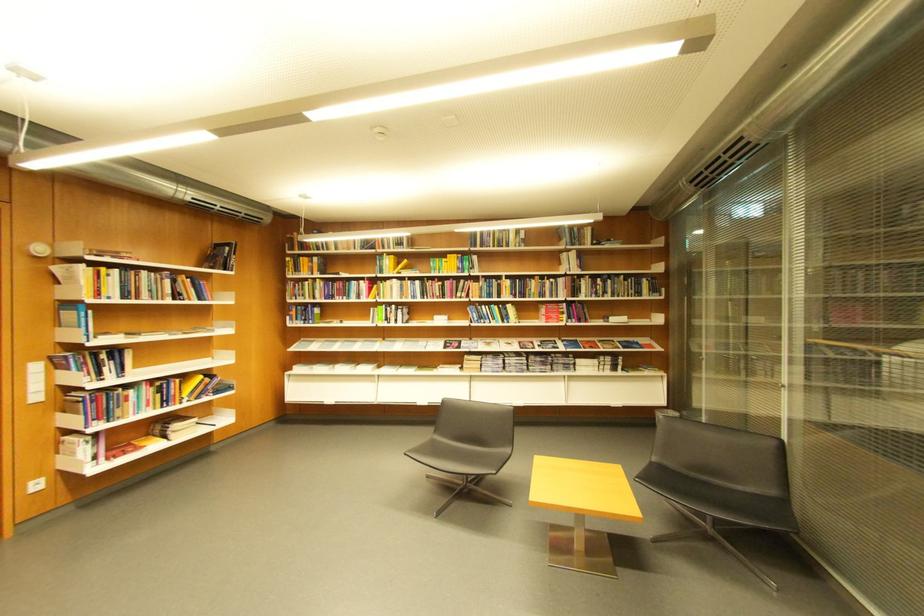
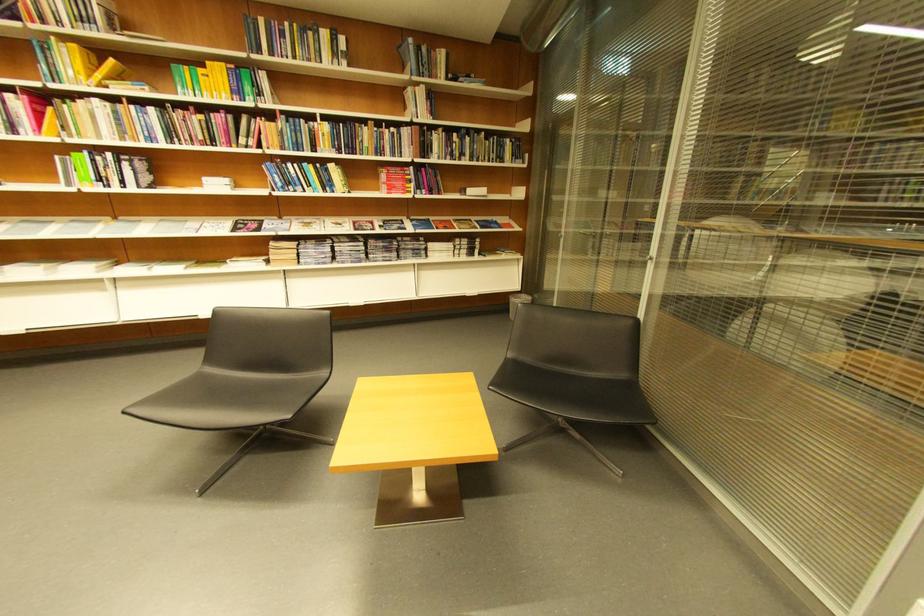
Locate, in the second image, the point that corresponds to point 405,282 in the first image.

(106, 102)